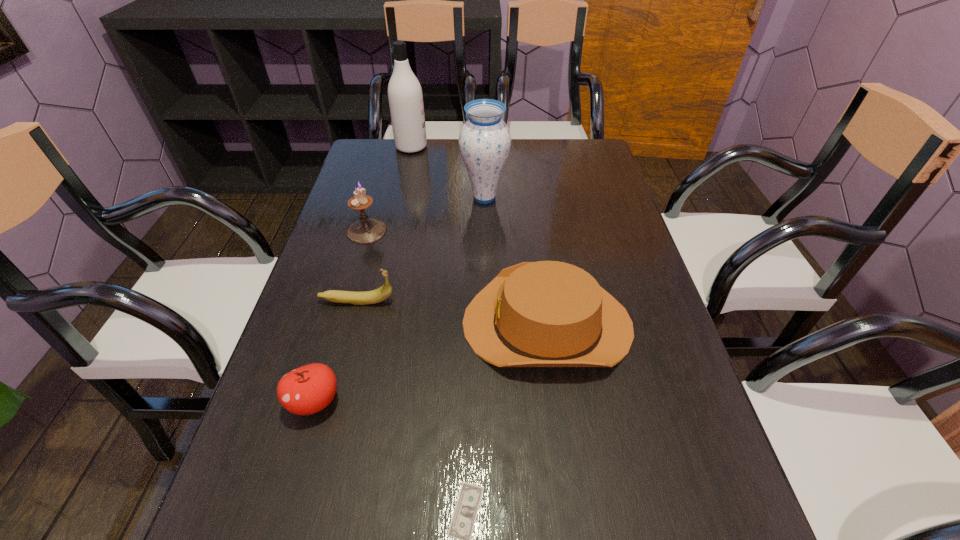
Find the location of a particular element. shampoo is located at coordinates (405, 96).

Locate an element on the screen. the farthest object is located at coordinates (405, 96).

You are a GUI agent. You are given a task and a screenshot of the screen. Output one action in this format:
    pyautogui.click(x=<x>, y=<y>)
    Task: Click on the vase
    This screenshot has width=960, height=540.
    Given the screenshot: What is the action you would take?
    pyautogui.click(x=484, y=140)

This screenshot has height=540, width=960. In order to click on the second tallest object in this screenshot , I will do `click(484, 140)`.

Where is `candle holder`? The image size is (960, 540). candle holder is located at coordinates (366, 230).

This screenshot has width=960, height=540. In order to click on the fifth shortest object in this screenshot , I will do `click(366, 230)`.

This screenshot has width=960, height=540. Identify the location of cowboy hat. (548, 313).

Where is `banana`? The height and width of the screenshot is (540, 960). banana is located at coordinates (384, 292).

Where is `apple`? apple is located at coordinates (309, 389).

Identify the location of vacant region located 0.210m on the front-facing side of the shampoo. Image resolution: width=960 pixels, height=540 pixels. (489, 147).